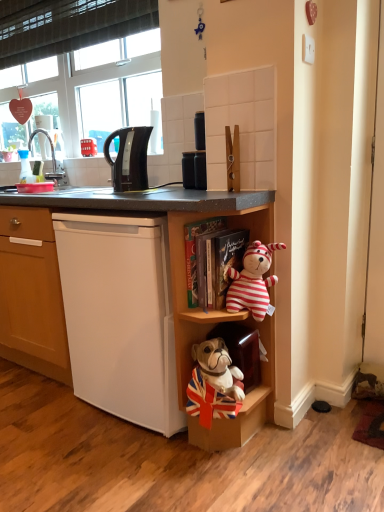
This screenshot has width=384, height=512. In order to click on blank space to the left of white matte refrigerator at lower left in this screenshot , I will do `click(42, 414)`.